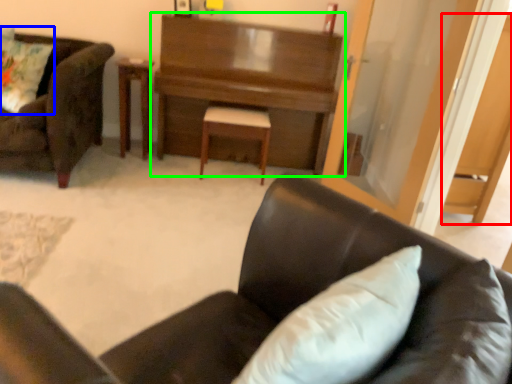
Question: Which object is the farthest from dark (highlighted by a red box)? Choose among these: pillow (highlighted by a blue box) or desk (highlighted by a green box).

Choices:
 (A) pillow
 (B) desk

Answer: (A)